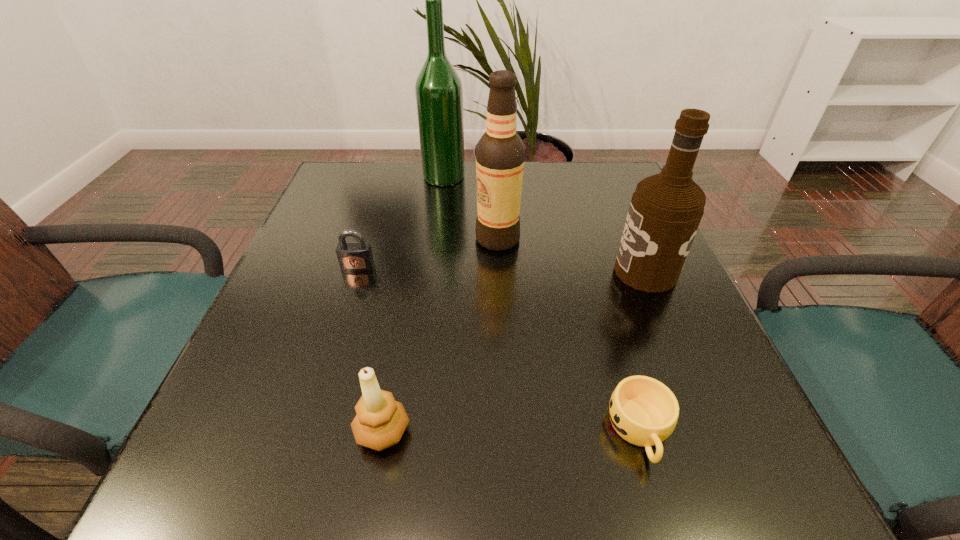
Where is `cup located in the near edge section of the desktop`? This screenshot has width=960, height=540. cup located in the near edge section of the desktop is located at coordinates (643, 411).

Image resolution: width=960 pixels, height=540 pixels. What are the coordinates of `object located in the left edge section of the desktop` in the screenshot? It's located at (353, 256).

This screenshot has height=540, width=960. In order to click on alcohol at the right edge in this screenshot , I will do `click(666, 209)`.

Where is `cup present at the right edge`? The height and width of the screenshot is (540, 960). cup present at the right edge is located at coordinates (643, 411).

At what (x,y) coordinates should I click in order to perform the action: click on object that is at the near right corner. Please return your answer as a coordinate pair (x, y). This screenshot has width=960, height=540. Looking at the image, I should click on (643, 411).

In the image, there is a desktop. Identify the location of vacant region at the far edge. pyautogui.click(x=574, y=193).

This screenshot has width=960, height=540. In the image, there is a desktop. Identify the location of vacant space at the near edge. (557, 475).

Locate an element on the screen. This screenshot has width=960, height=540. vacant area at the left edge of the desktop is located at coordinates (285, 371).

The width and height of the screenshot is (960, 540). In order to click on free space at the right edge in this screenshot , I will do `click(603, 222)`.

Image resolution: width=960 pixels, height=540 pixels. Identify the location of free location at the far left corner. [x=388, y=170].